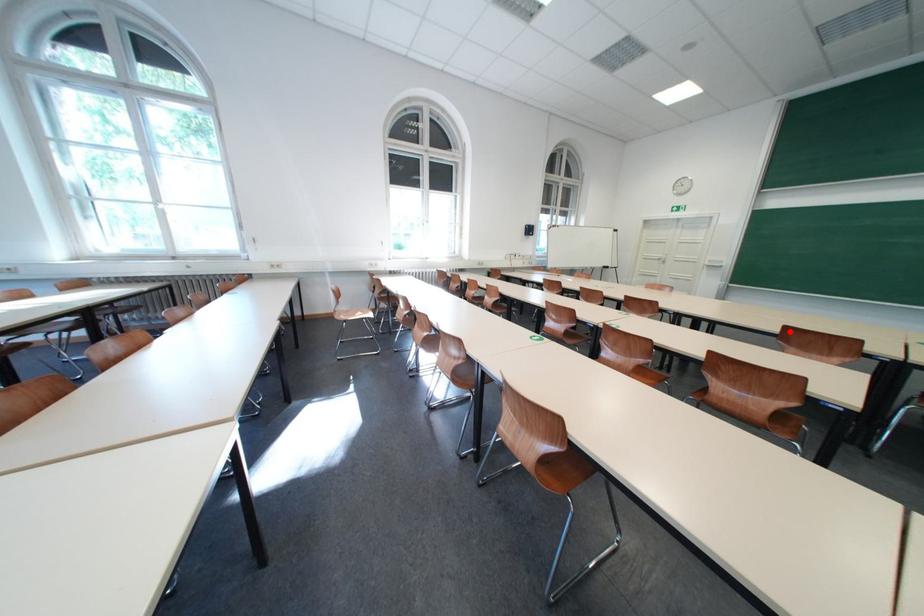
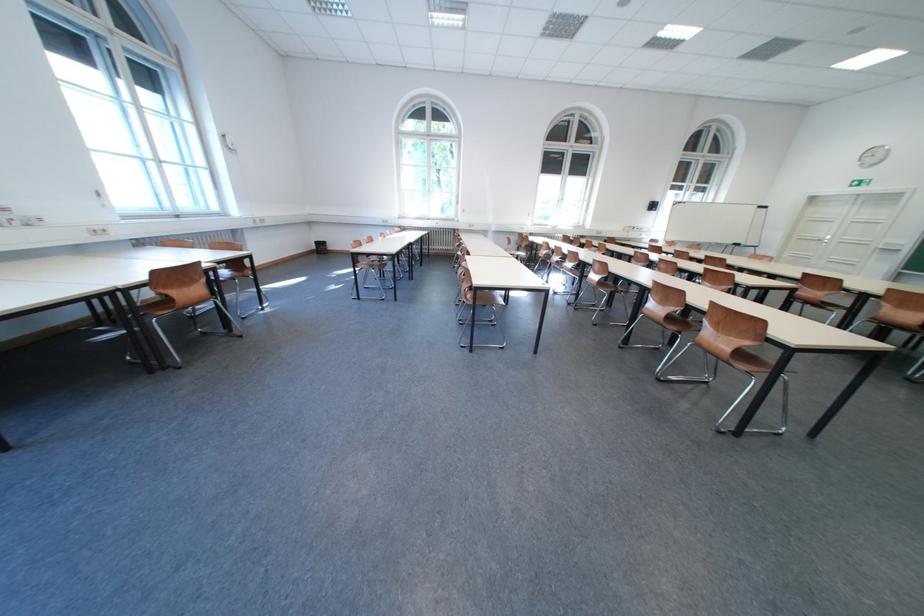
Question: I am providing you with two images of the same scene from different viewpoints. A red point is marked on the first image. Can you still see the location of the red point in image 2?

Choices:
 (A) Yes
 (B) No

Answer: (A)